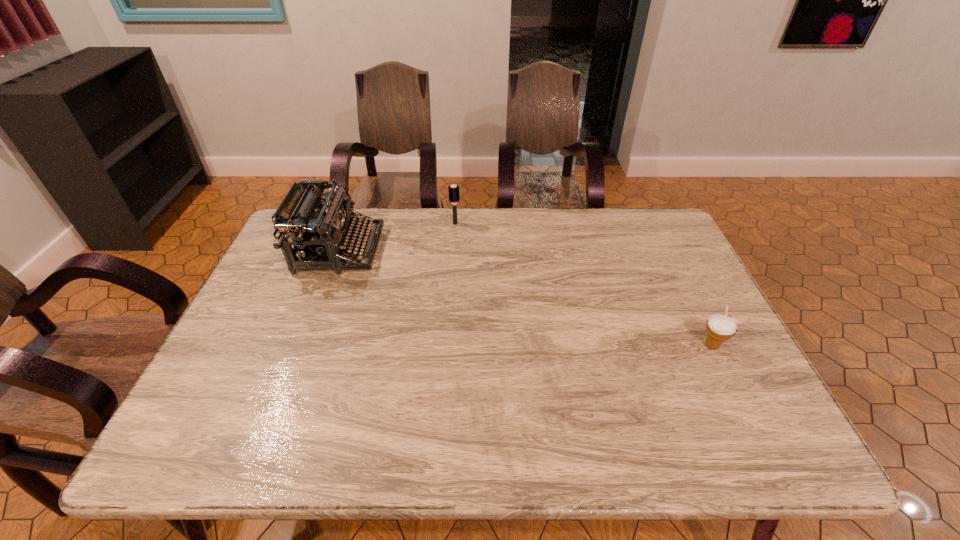
Find the location of a particular element. The height and width of the screenshot is (540, 960). hairbrush that is positioned at the far edge is located at coordinates (453, 190).

Image resolution: width=960 pixels, height=540 pixels. Identify the location of object that is at the left edge. (315, 234).

At what (x,y) coordinates should I click in order to perform the action: click on object located in the right edge section of the desktop. Please return your answer as a coordinate pair (x, y). This screenshot has height=540, width=960. Looking at the image, I should click on (719, 327).

Locate an element on the screen. object that is positioned at the far left corner is located at coordinates (315, 234).

Where is `vacant space at the far edge of the desktop`? The width and height of the screenshot is (960, 540). vacant space at the far edge of the desktop is located at coordinates (476, 213).

Where is `free location at the near edge`? free location at the near edge is located at coordinates (309, 426).

Where is `vacant space at the left edge`? The height and width of the screenshot is (540, 960). vacant space at the left edge is located at coordinates (259, 334).

In the image, there is a desktop. Identify the location of vacant space at the right edge. (704, 313).

The height and width of the screenshot is (540, 960). In the image, there is a desktop. Find the location of `vacant space at the near left corner`. vacant space at the near left corner is located at coordinates (177, 456).

At what (x,y) coordinates should I click in order to perform the action: click on vacant region at the far right corner. Please return your answer as a coordinate pair (x, y). The image size is (960, 540). Looking at the image, I should click on (652, 243).